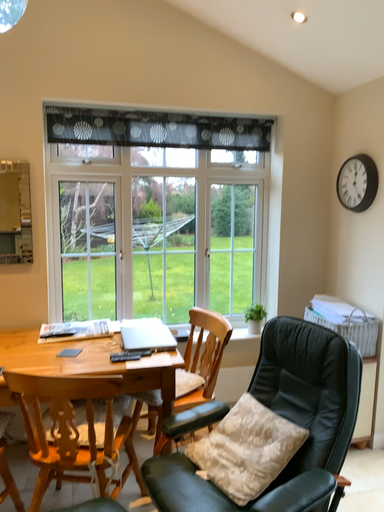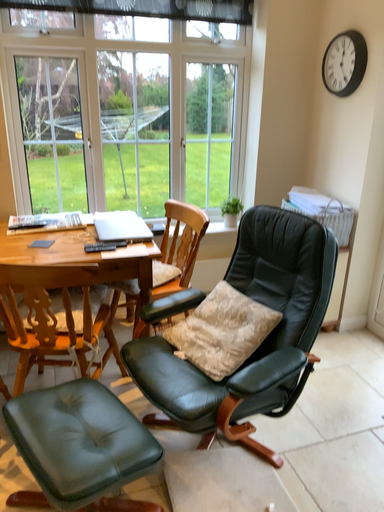
Question: How did the camera likely rotate when shooting the video?

Choices:
 (A) rotated downward
 (B) rotated upward

Answer: (A)